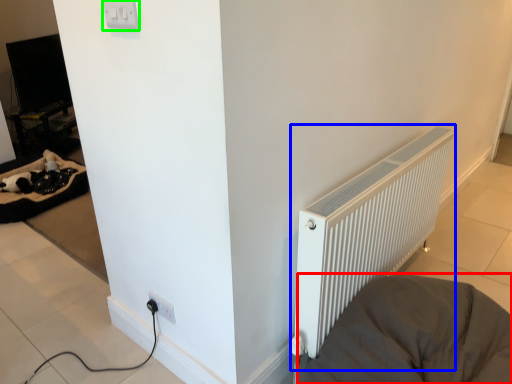
Question: Based on their relative distances, which object is nearer to furniture (highlighted by a red box)? Choose from radiator (highlighted by a blue box) and electric outlet (highlighted by a green box).

Choices:
 (A) radiator
 (B) electric outlet

Answer: (A)